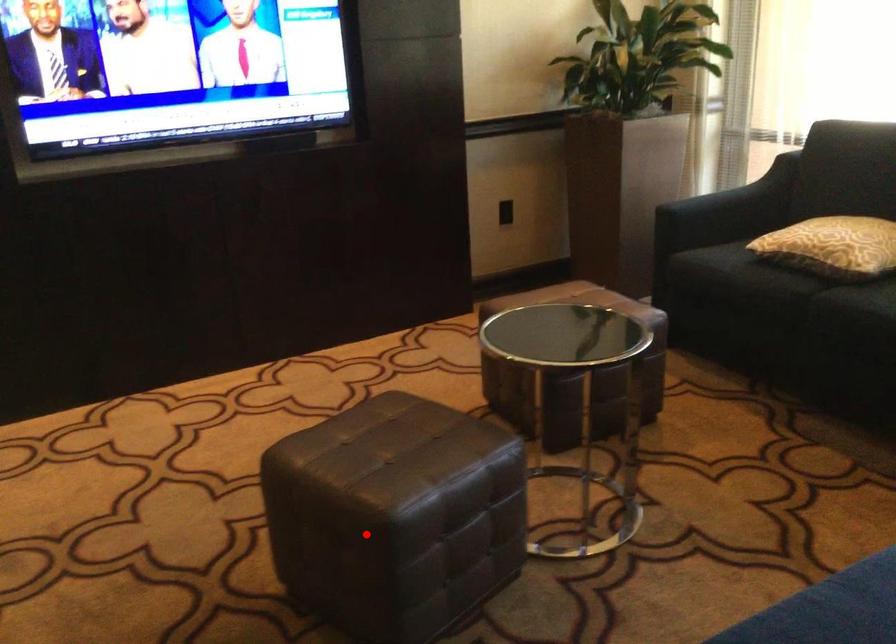
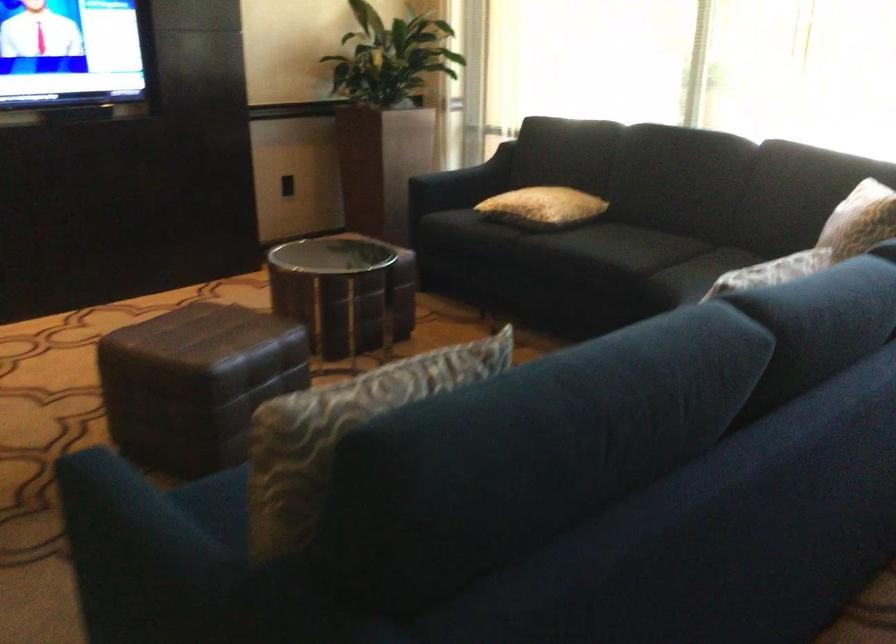
Question: A red point is marked in image1. In image2, is the corresponding 3D point closer to the camera or farther? Reply with the corresponding letter.

Choices:
 (A) The corresponding 3D point is closer.
 (B) The corresponding 3D point is farther.

Answer: (B)